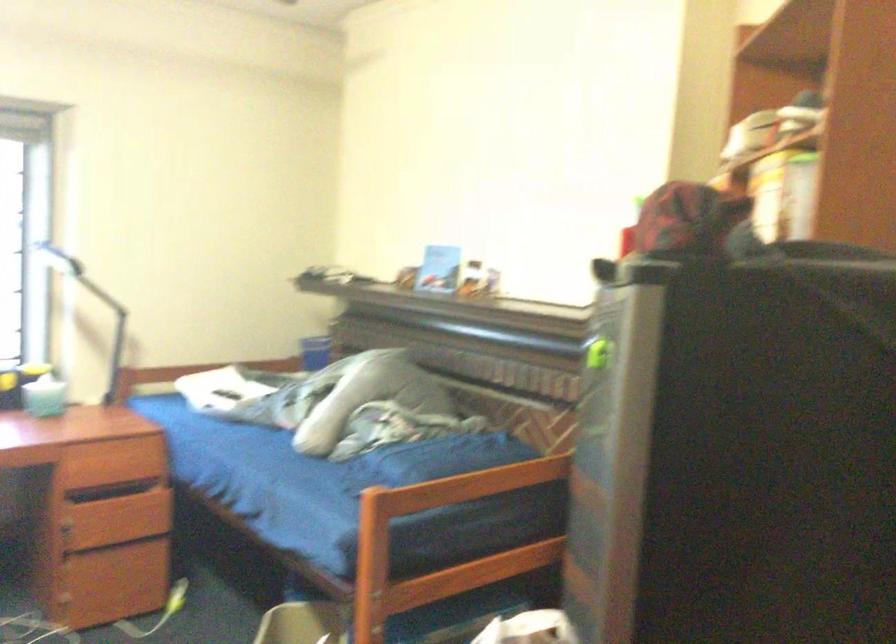
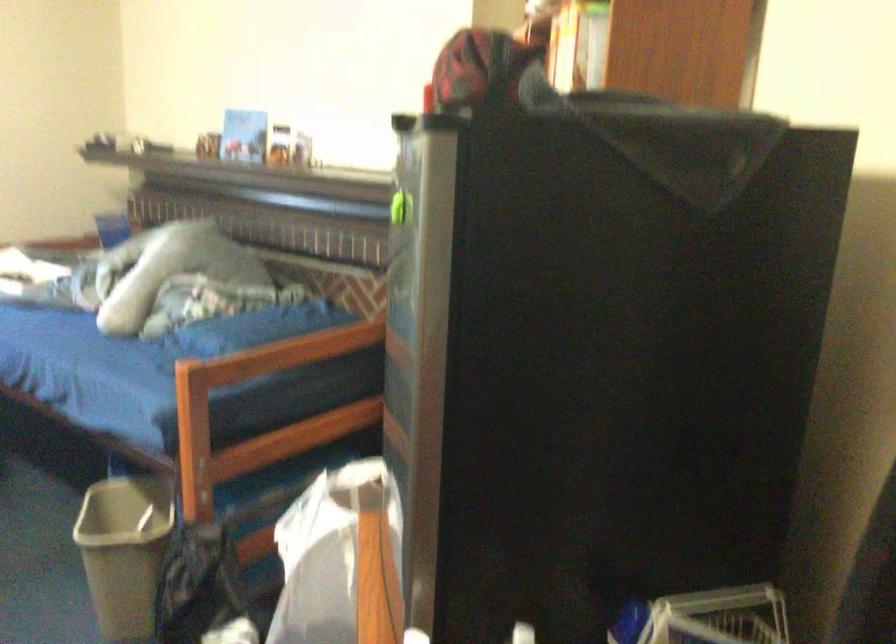
Question: The camera is either moving clockwise (left) or counter-clockwise (right) around the object. The first image is from the beginning of the video and the second image is from the end. Is the camera moving left or right when shooting the video?

Choices:
 (A) Left
 (B) Right

Answer: (A)